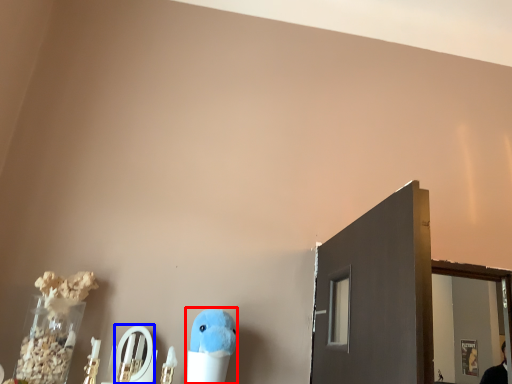
Question: Which point is further to the camera, toy (highlighted by a red box) or mirror (highlighted by a blue box)?

Choices:
 (A) toy
 (B) mirror

Answer: (B)